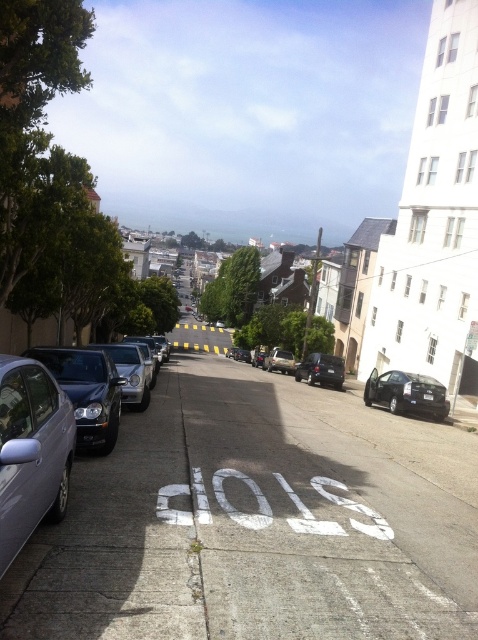
Is satin silver sedan at center-left to the left of metallic silver sedan at center from the viewer's perspective?

Yes, satin silver sedan at center-left is to the left of metallic silver sedan at center.

Does satin silver sedan at center-left have a lesser height compared to metallic silver sedan at center?

Yes, satin silver sedan at center-left is shorter than metallic silver sedan at center.

Is point (139, 406) closer to camera compared to point (281, 365)?

Yes, it is.

Where is `satin silver sedan at center-left`? Image resolution: width=478 pixels, height=640 pixels. satin silver sedan at center-left is located at coordinates (129, 372).

Is black matte car at lower right closer to the viewer compared to satin silver sedan at center-left?

That is False.

Does black matte car at lower right have a greater height compared to satin silver sedan at center-left?

Correct, black matte car at lower right is much taller as satin silver sedan at center-left.

Does point (415, 381) lie in front of point (137, 380)?

No.

I want to click on black matte car at lower right, so click(x=406, y=394).

In the scene shown: Can you confirm if white painted pavement at center is thinner than shiny black suv at center?

No.

Which is in front, point (194, 595) or point (333, 385)?

Point (194, 595)

The width and height of the screenshot is (478, 640). Identify the location of white painted pavement at center. (258, 522).